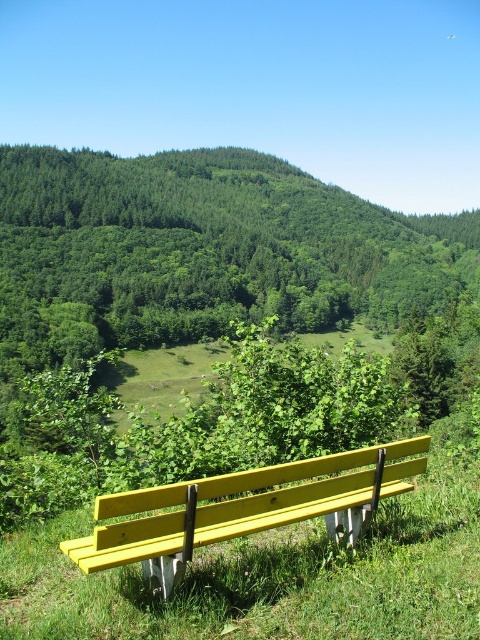
You are planning to take a photo of the yellow painted wood bench at center. To ensure the green leafy tree at center doesn not block the view of the bench, should you stand closer to or farther away from the bench?

To ensure the green leafy tree at center does not block the view of the yellow painted wood bench at center, you should stand farther away from the bench. Since the green leafy tree at center is larger in size than the yellow painted wood bench at center, increasing the distance will reduce the tree s apparent size relative to the bench, minimizing the chance of it blocking the view.

From the picture: You are planning to place a new bench in the park. The current bench is the yellow painted wood bench at center. You want to know if the green leafy tree at center is wide enough to provide shade over the bench. Can you determine this based on the scene?

The green leafy tree at center is wider than the yellow painted wood bench at center, so it can provide sufficient shade over the bench.